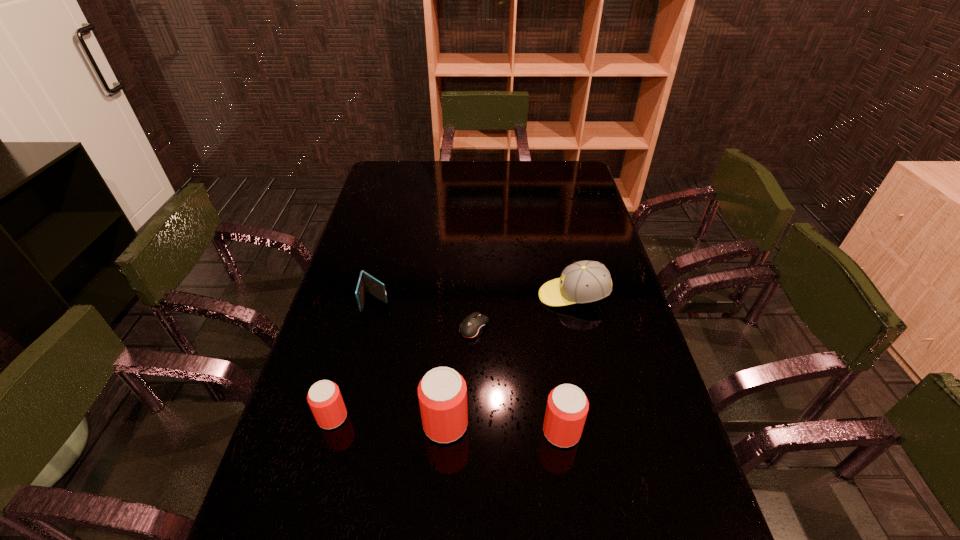
Find the location of a particular element. The width and height of the screenshot is (960, 540). free region that satisfies the following two spatial constraints: 1. on the front-facing side of the baseball cap; 2. on the exterior surface of the wallet is located at coordinates (574, 301).

This screenshot has height=540, width=960. What are the coordinates of `free point that satisfies the following two spatial constraints: 1. on the front side of the second beer can from left to right; 2. on the right side of the leftmost beer can` in the screenshot? It's located at (330, 424).